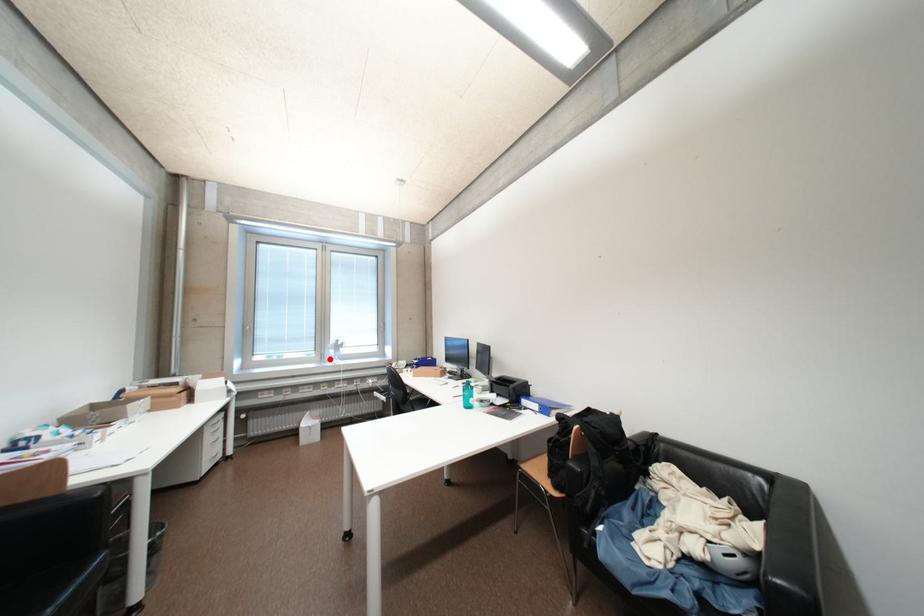
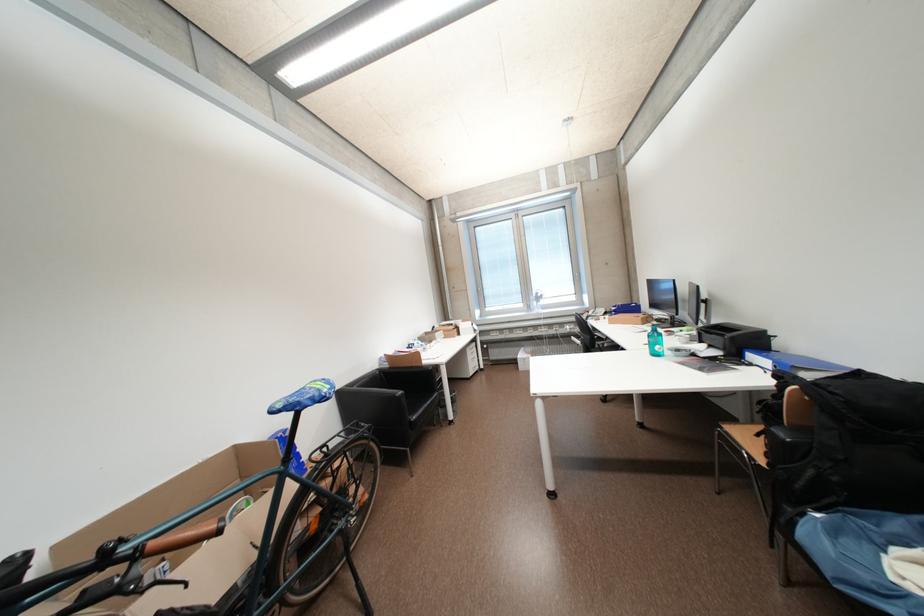
The point at the highlighted location is marked in the first image. Where is the corresponding point in the second image?

(537, 310)